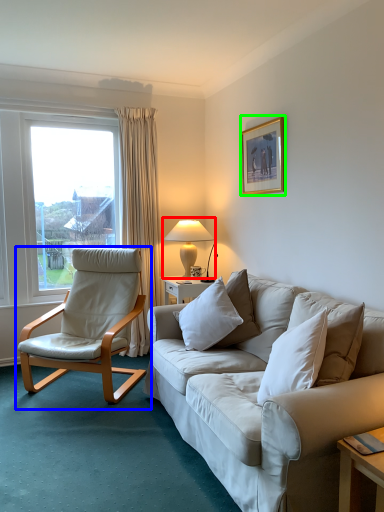
Question: Which object is positioned farthest from table lamp (highlighted by a red box)? Select from chair (highlighted by a blue box) and picture frame (highlighted by a green box).

Choices:
 (A) chair
 (B) picture frame

Answer: (A)